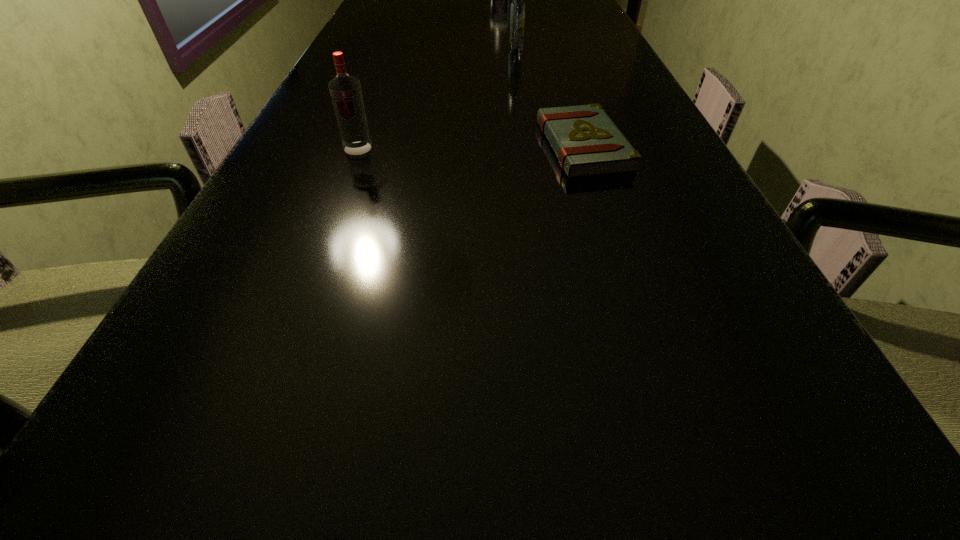
Find the location of a particular element. Image resolution: width=960 pixels, height=540 pixels. the right vodka is located at coordinates (517, 9).

Where is `the farthest object`? the farthest object is located at coordinates (517, 9).

Locate an element on the screen. The width and height of the screenshot is (960, 540). the leftmost object is located at coordinates (345, 90).

Find the location of a particular element. This screenshot has height=540, width=960. the left vodka is located at coordinates (345, 90).

At what (x,y) coordinates should I click in order to perform the action: click on the shortest object. Please return your answer as a coordinate pair (x, y). The image size is (960, 540). Looking at the image, I should click on (587, 143).

Find the location of a particular element. the rightmost object is located at coordinates (587, 143).

Where is `free space located 0.370m on the label of the second object from right to left`? The height and width of the screenshot is (540, 960). free space located 0.370m on the label of the second object from right to left is located at coordinates (526, 120).

Where is `blank area located 0.390m on the front label of the nearer vodka`? blank area located 0.390m on the front label of the nearer vodka is located at coordinates (293, 323).

The image size is (960, 540). Find the location of `vacant space located on the front of the book`. vacant space located on the front of the book is located at coordinates (601, 205).

Find the location of a particular element. object situated at the left edge is located at coordinates (345, 90).